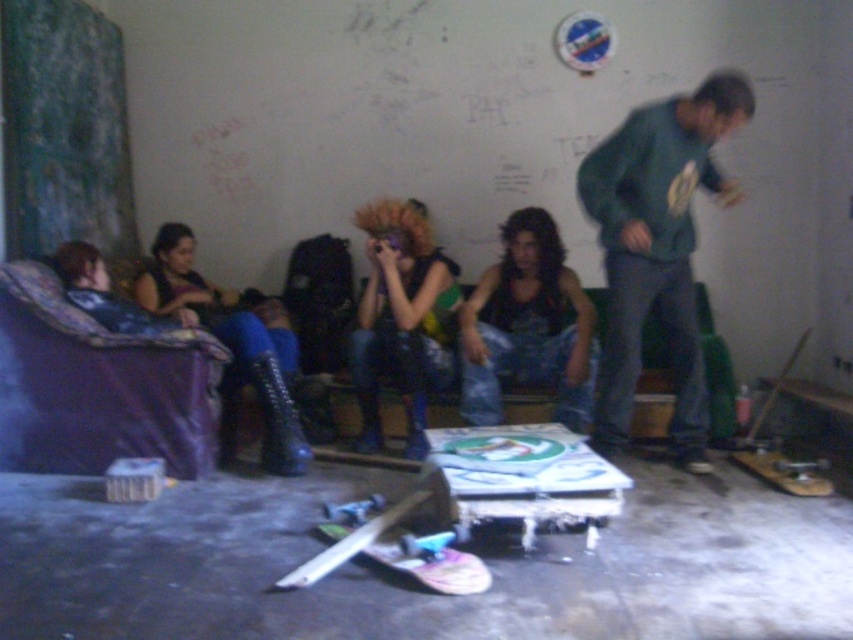
Question: Is green matte sweatshirt at right positioned behind leather boots at lower left?

Choices:
 (A) yes
 (B) no

Answer: (B)

Question: Which object is closer to the camera taking this photo?

Choices:
 (A) shiny purple hair at center
 (B) denim jeans at center
 (C) white wooden skateboard at center
 (D) green matte sweatshirt at right

Answer: (C)

Question: Can you confirm if shiny purple hair at center is positioned to the left of leather boots at lower left?

Choices:
 (A) yes
 (B) no

Answer: (B)

Question: Among these objects, which one is nearest to the camera?

Choices:
 (A) green matte sweatshirt at right
 (B) shiny purple hair at center

Answer: (A)

Question: Which object is positioned closest to the green matte sweatshirt at right?

Choices:
 (A) leather boots at lower left
 (B) denim jeans at center

Answer: (B)

Question: Does denim jeans at center have a smaller size compared to white wooden skateboard at center?

Choices:
 (A) no
 (B) yes

Answer: (A)